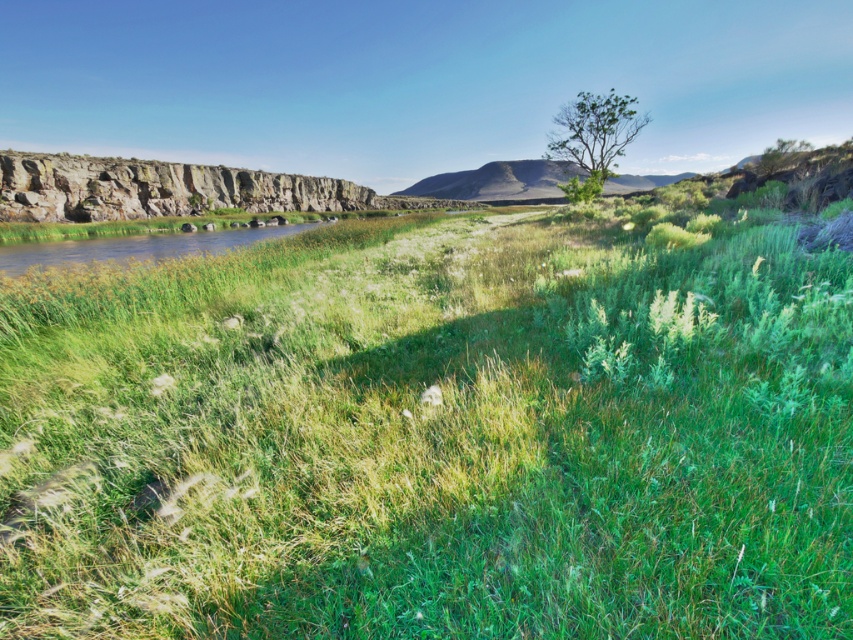
You are a hiker who wants to cross the river. You see the green grassy at center and the rugged brown hillside at center. Which terrain would be easier to walk on?

The green grassy at center is smaller than rugged brown hillside at center, so the green grassy at center would be easier to walk on because it is flatter and less rocky compared to the rugged brown hillside at center.